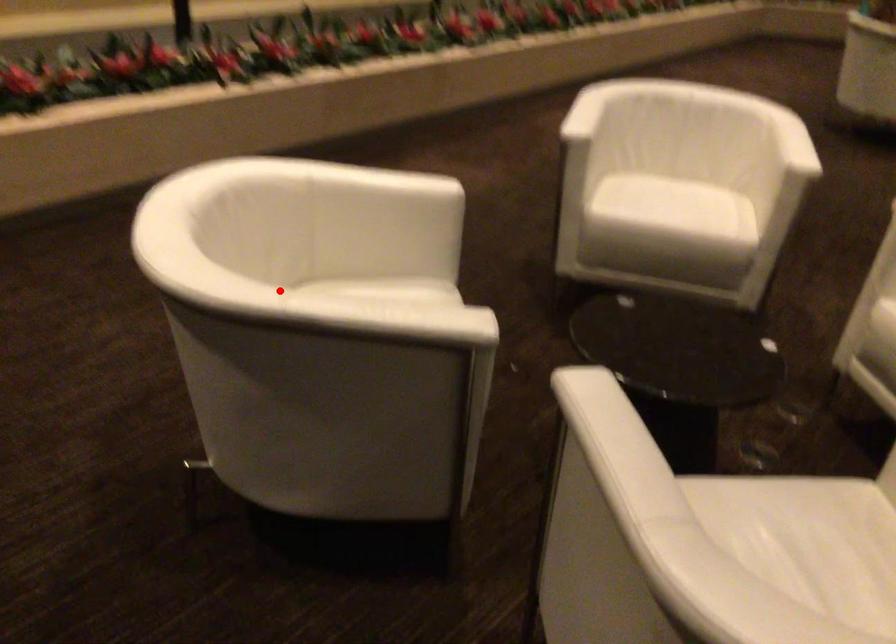
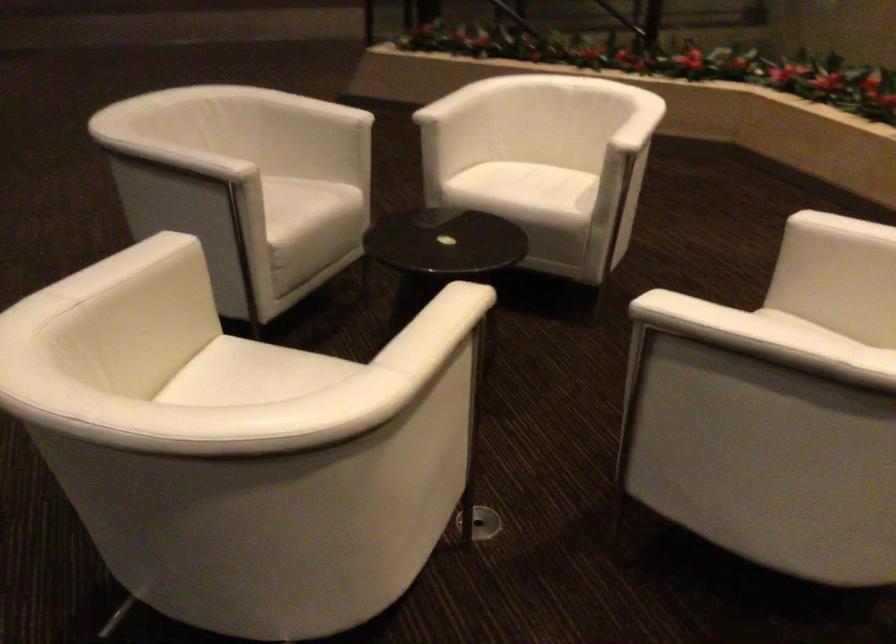
Where in the second image is the point corresponding to the highlighted location from the first image?

(469, 89)